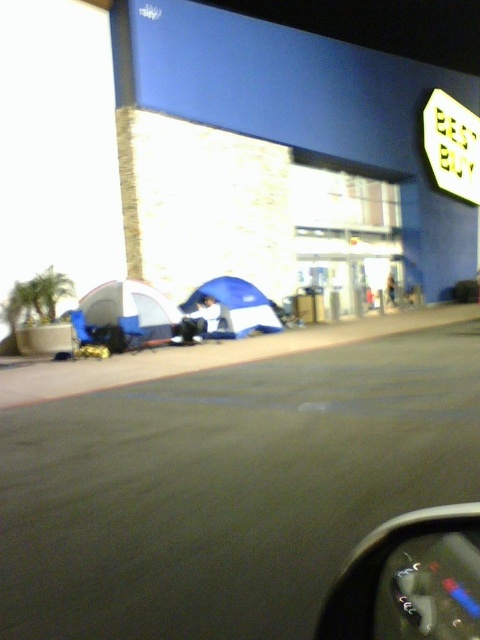
Question: Is yellow plastic sign at upper right wider than blue fabric tent at center?

Choices:
 (A) yes
 (B) no

Answer: (A)

Question: Is yellow plastic sign at upper right in front of blue fabric tent at center?

Choices:
 (A) yes
 (B) no

Answer: (B)

Question: Which object is the farthest from the metallic gray dashboard at lower center?

Choices:
 (A) blue fabric tent at lower left
 (B) yellow plastic sign at upper right

Answer: (B)

Question: Is yellow plastic sign at upper right below blue fabric tent at center?

Choices:
 (A) yes
 (B) no

Answer: (B)

Question: Among these points, which one is farthest from the camera?

Choices:
 (A) coord(192,296)
 (B) coord(398,612)

Answer: (A)

Question: Which point is farther to the camera?

Choices:
 (A) (242, 291)
 (B) (448, 193)
 (C) (120, 308)
 (D) (416, 595)

Answer: (B)